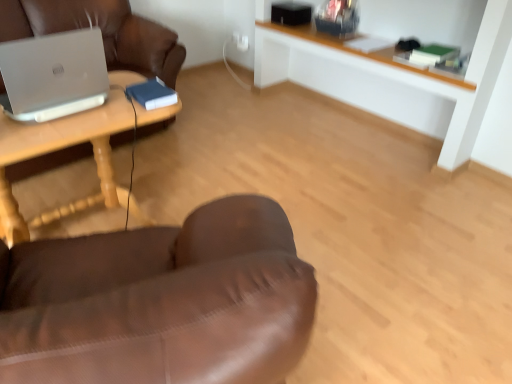
Identify the location of vacant space to the right of silver metallic laptop at left. The image size is (512, 384). (117, 110).